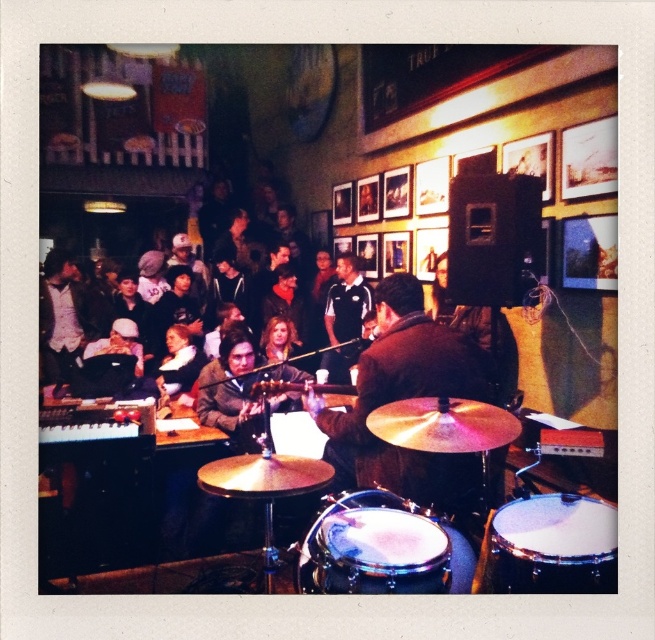
Does white drumhead at center have a lesser width compared to black jersey at center?

No, white drumhead at center is not thinner than black jersey at center.

Is white drumhead at center closer to camera compared to black jersey at center?

Yes, it is.

Is point (586, 508) in front of point (341, 304)?

That is True.

Identify the location of white drumhead at center. (550, 547).

Which is behind, point (346, 428) or point (514, 586)?

The point (346, 428) is more distant.

Which is more to the right, shiny brown jacket at center or white drumhead at center?

white drumhead at center is more to the right.

Which is in front, point (384, 448) or point (614, 573)?

Point (614, 573) is more forward.

Find the location of a particular element. Image resolution: width=655 pixels, height=640 pixels. shiny brown jacket at center is located at coordinates (403, 397).

Which is in front, point (407, 515) or point (591, 582)?

Point (591, 582) is more forward.

Does shiny silver drum at center appear over white drumhead at center?

Incorrect, shiny silver drum at center is not positioned above white drumhead at center.

This screenshot has width=655, height=640. In order to click on shiny silver drum at center in this screenshot , I will do `click(375, 548)`.